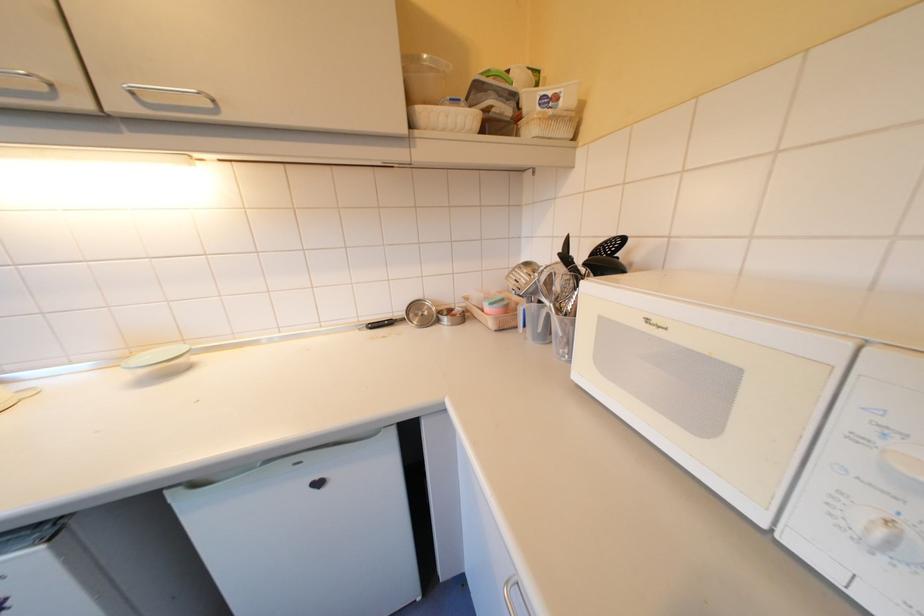
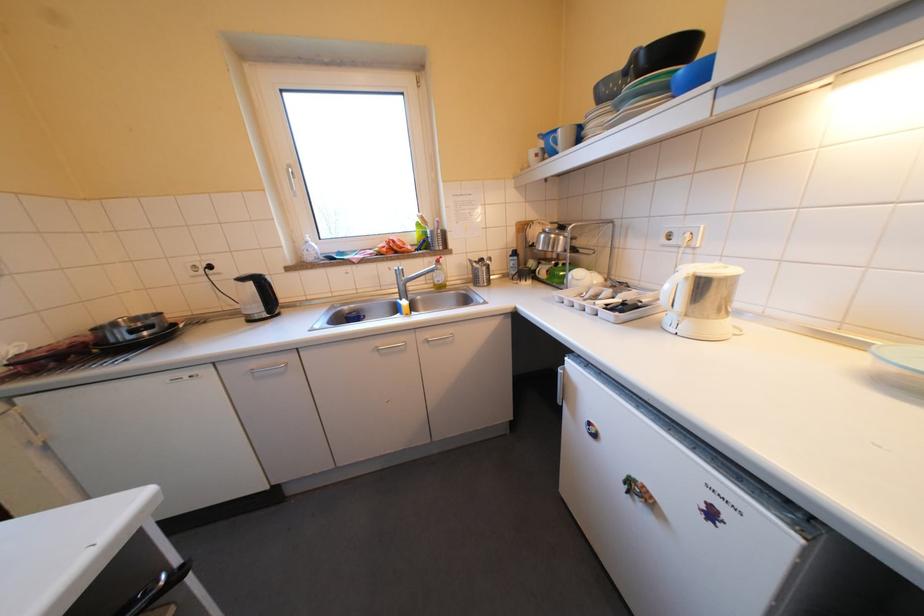
The first image is from the beginning of the video and the second image is from the end. How did the camera likely rotate when shooting the video?

The camera rotated toward left-down.